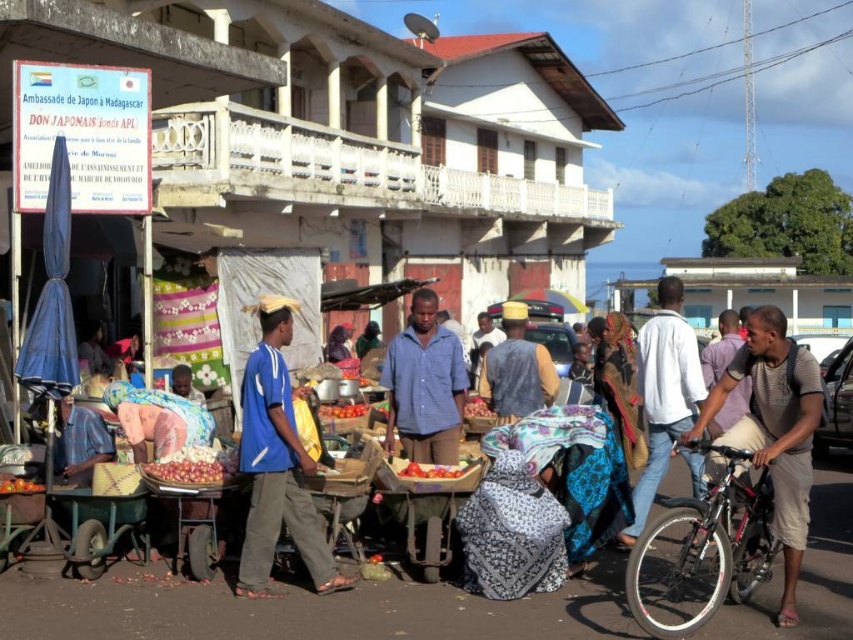
You are a customer at the market and want to pick up the ripe red tomato at center. However, there is a blue fabric bag at center in your way. Can you reach the tomato without moving the bag?

The blue fabric bag at center is in front of the ripe red tomato at center, so you cannot reach the tomato without moving the bag.

You are a tourist standing at the entrance of the market and want to buy a yellow fabric hat. The market map shows coordinates for items. What are the coordinates of the yellow fabric hat at center?

The coordinates of the yellow fabric hat at center are at point (515,369).